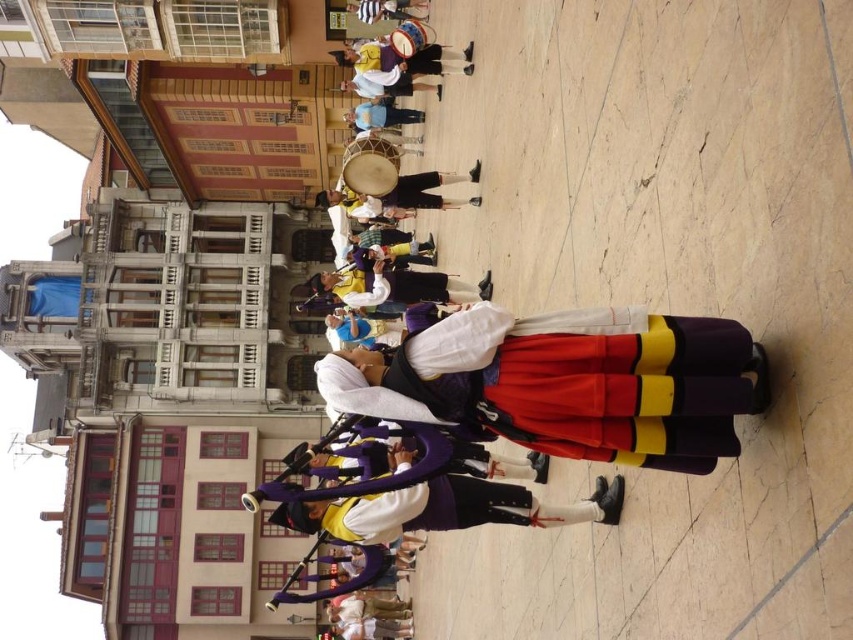
Which of these two, velvet purple skirt at center or white cotton shirt at center, stands taller?

white cotton shirt at center is taller.

Does velvet purple skirt at center come behind white cotton shirt at center?

No.

Identify the location of velvet purple skirt at center. This screenshot has width=853, height=640. (567, 381).

Who is more distant from viewer, [357,508] or [378,628]?

The point [378,628] is behind.

Does purple velvet bagpipe at center have a lesser width compared to white cotton shirt at center?

Incorrect, purple velvet bagpipe at center's width is not less than white cotton shirt at center's.

What do you see at coordinates (444, 508) in the screenshot? I see `purple velvet bagpipe at center` at bounding box center [444, 508].

At what (x,y) coordinates should I click in order to perform the action: click on purple velvet bagpipe at center. Please return your answer as a coordinate pair (x, y). The height and width of the screenshot is (640, 853). Looking at the image, I should click on (444, 508).

Who is higher up, velvet purple skirt at center or purple velvet bagpipe at center?

velvet purple skirt at center is higher up.

Does point (621, 413) lie in front of point (387, 449)?

Yes, point (621, 413) is closer to viewer.

Is point (495, 394) farther from viewer compared to point (466, 488)?

No, it is in front of (466, 488).

This screenshot has width=853, height=640. Identify the location of velvet purple skirt at center. (567, 381).